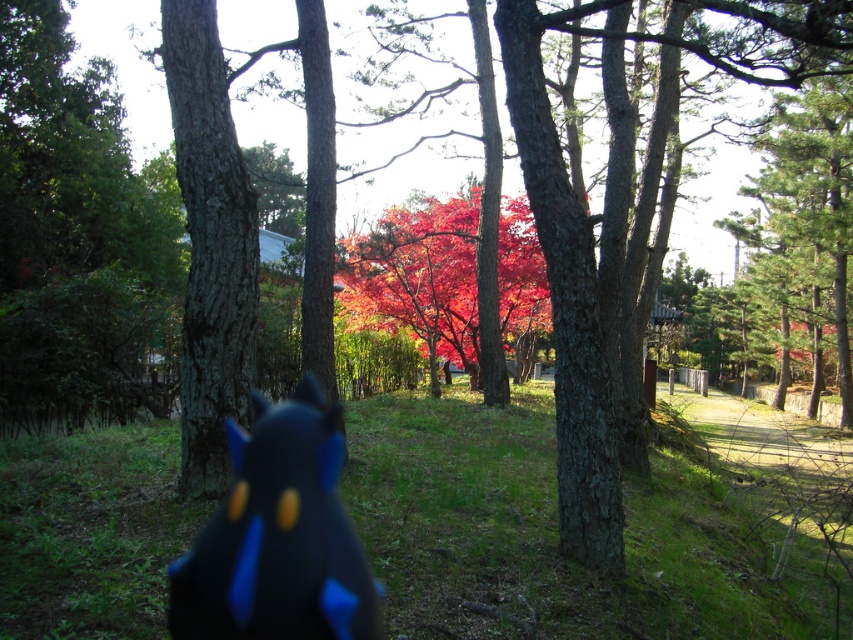
Based on the photo, you are a hiker who wants to place a small marker between the matte black plush toy at center and the vivid red leaves at center. Which object should you place the marker closer to if you want it near the smaller object?

The matte black plush toy at center is smaller than the vivid red leaves at center, so you should place the marker closer to the matte black plush toy at center.

You are standing in the park scene described. You see a point marked at coordinates [277,536]. What object is located at that point?

The point at coordinates [277,536] corresponds to the matte black plush toy at center.

You are a photographer trying to capture both the matte black plush toy at center and the vivid red leaves at center in a single frame. Which object should you focus on first if you want to ensure both are in sharp focus?

You should focus on the vivid red leaves at center first since the matte black plush toy at center is smaller in width, making it easier to keep both in focus by focusing on the larger object.